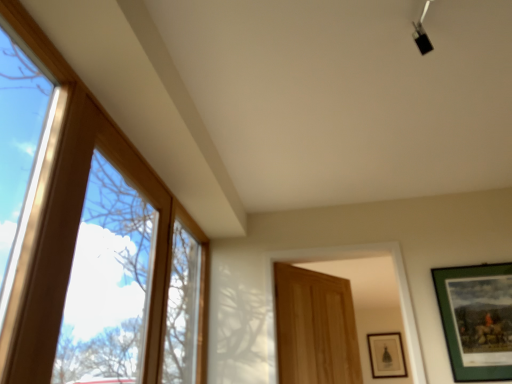
Question: Would you say wooden door at center is to the left or to the right of green matte picture frame at lower right, which is the first picture frame in right-to-left order, in the picture?

Choices:
 (A) right
 (B) left

Answer: (B)

Question: Looking at their shapes, would you say wooden door at center is wider or thinner than green matte picture frame at lower right, the first picture frame from the bottom?

Choices:
 (A) thin
 (B) wide

Answer: (B)

Question: Considering the real-world distances, which object is farthest from the clear glass window at left?

Choices:
 (A) wooden door at center
 (B) green matte picture frame at lower right, which is the first picture frame in right-to-left order
 (C) green matte picture frame at right, which is the 2th picture frame from bottom to top

Answer: (B)

Question: Estimate the real-world distances between objects in this image. Which object is closer to the wooden door at center?

Choices:
 (A) green matte picture frame at lower right, acting as the 2th picture frame starting from the top
 (B) green matte picture frame at right, which is the 1th picture frame from top to bottom
 (C) clear glass window at left

Answer: (B)